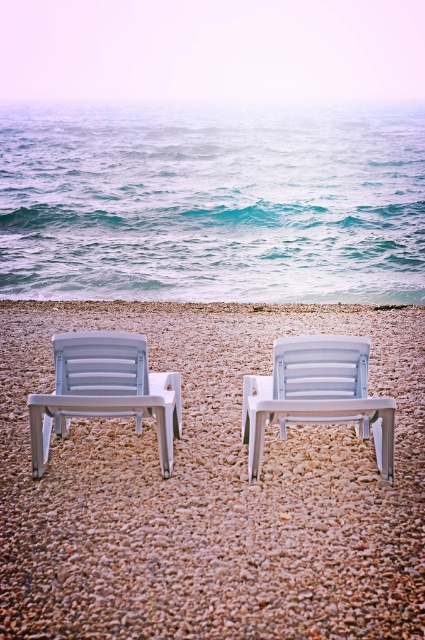
You are setting up a beach umbrella and need to know which chair takes up more space. Which one is larger between the white plastic beach chair at center and the white plastic beach chair at left?

The white plastic beach chair at left is larger because the white plastic beach chair at center occupies less space than it.

You are standing at the center of the beach and want to place your beach towel on the white plastic beach chair at center. Where exactly should you look to find the chair?

The white plastic beach chair at center is located at the coordinates point (317,394).

You are standing on the beach and want to place a small flag exactly at the position of the blue water at upper center. According to the coordinates provided, where should you place the flag?

The blue water at upper center is located at point coordinates 0.316 on the x axis and 0.499 on the y axis, so you should place the flag at those coordinates.